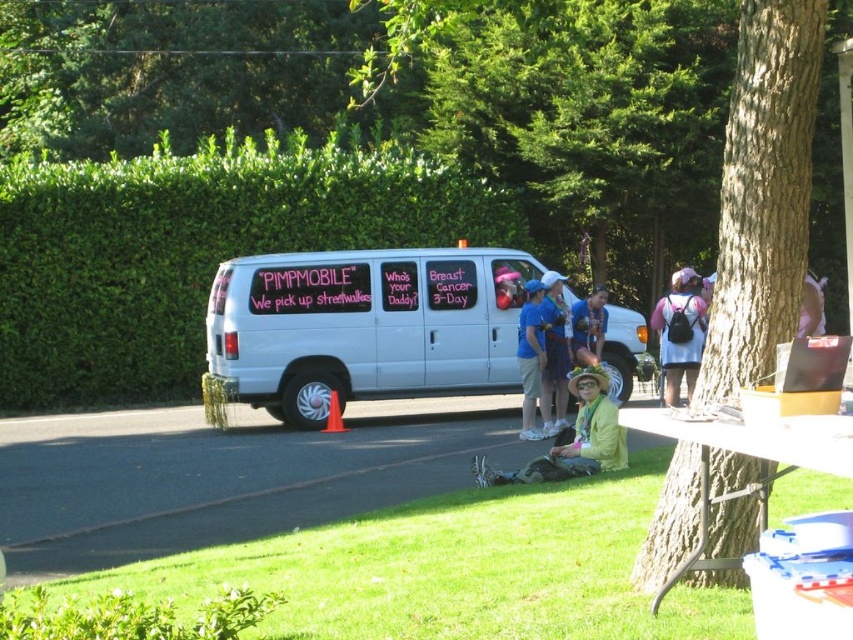
Is point (691, 273) closer to camera compared to point (811, 294)?

No, (691, 273) is further to viewer.

Can you confirm if pink backpack at center is positioned below pink fabric shirt at upper right?

Indeed, pink backpack at center is positioned under pink fabric shirt at upper right.

Which is in front, point (695, 378) or point (798, 330)?

Point (798, 330) is more forward.

This screenshot has height=640, width=853. What are the coordinates of `pink backpack at center` in the screenshot? It's located at (680, 332).

Between brown rough bark tree at center and blue fabric shirt at center, which one appears on the right side from the viewer's perspective?

From the viewer's perspective, brown rough bark tree at center appears more on the right side.

Is point (735, 269) in front of point (550, 273)?

Yes, it is in front of point (550, 273).

The image size is (853, 640). In order to click on brown rough bark tree at center in this screenshot , I will do `click(763, 193)`.

Does white matte van at center have a greater height compared to brown rough bark tree at center?

Yes.

Is white matte van at center bigger than brown rough bark tree at center?

Yes, white matte van at center is bigger than brown rough bark tree at center.

Is point (398, 248) farther from camera compared to point (753, 112)?

Yes, it is behind point (753, 112).

The width and height of the screenshot is (853, 640). I want to click on white matte van at center, so point(364,326).